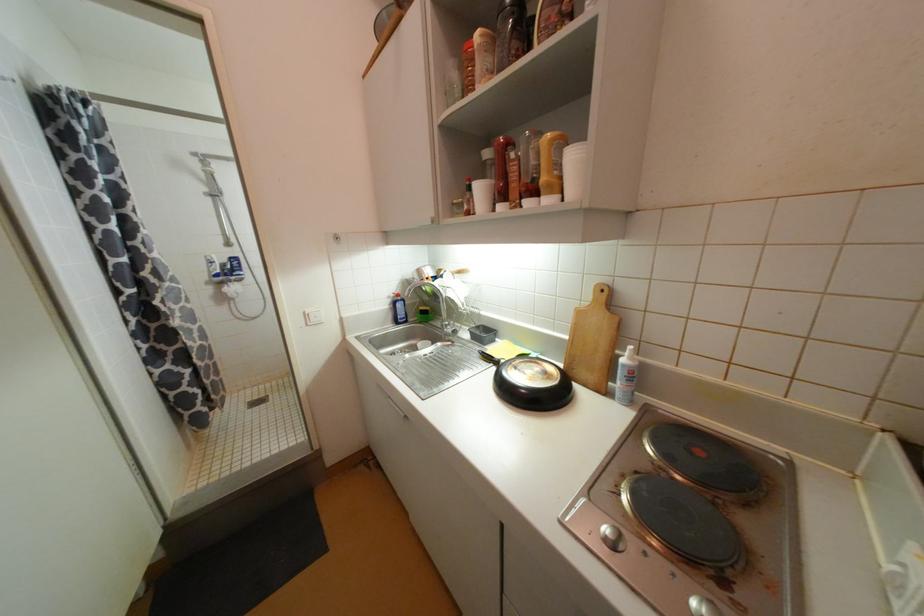
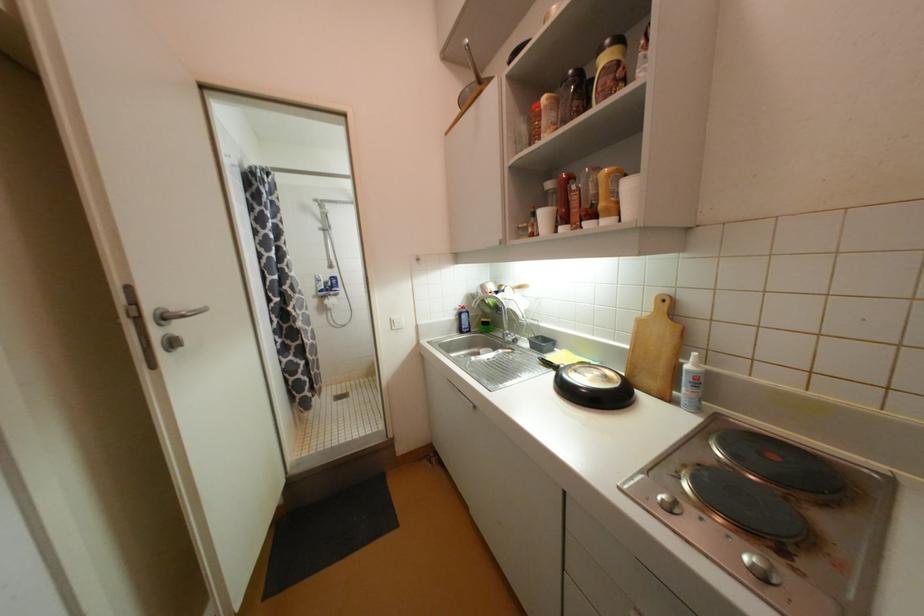
Locate, in the second image, the point that corresponds to point 628,361 in the first image.

(693, 368)